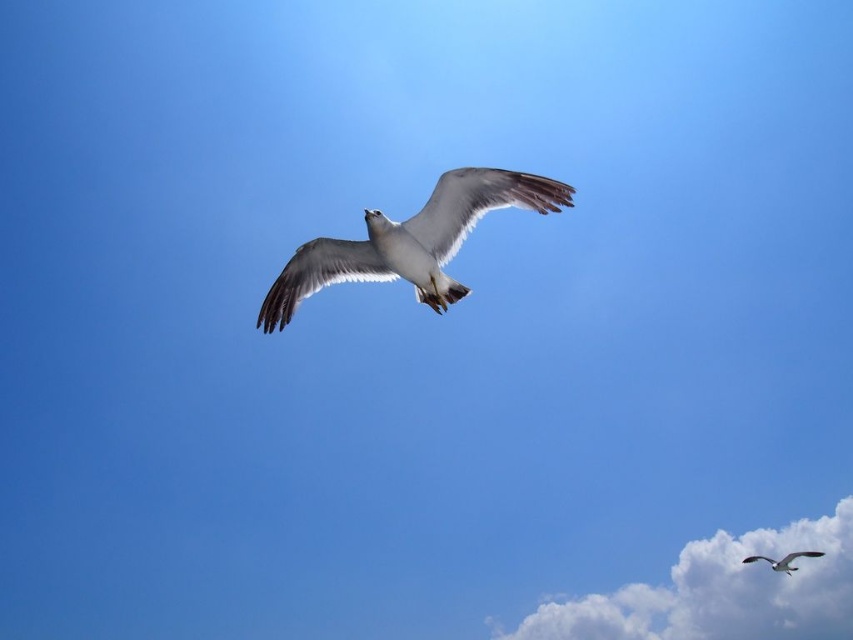
Who is higher up, white fluffy cloud at lower right or white feathered bird at center?

Positioned higher is white feathered bird at center.

Who is more forward, (831, 545) or (361, 259)?

Point (361, 259) is more forward.

Locate an element on the screen. white fluffy cloud at lower right is located at coordinates (722, 592).

Is white feathered bird at center closer to the viewer compared to white feathered bird at lower right?

Yes, white feathered bird at center is in front of white feathered bird at lower right.

Is white feathered bird at center shorter than white feathered bird at lower right?

No, white feathered bird at center is not shorter than white feathered bird at lower right.

Does point (463, 173) lie behind point (791, 556)?

No, (463, 173) is closer to viewer.

The image size is (853, 640). In order to click on white feathered bird at center in this screenshot , I will do `click(410, 241)`.

Is white fluffy cloud at lower right shorter than white feathered bird at lower right?

No.

Measure the distance between white fluffy cloud at lower right and camera.

53.97 meters

At what (x,y) coordinates should I click in order to perform the action: click on white fluffy cloud at lower right. Please return your answer as a coordinate pair (x, y). Looking at the image, I should click on point(722,592).